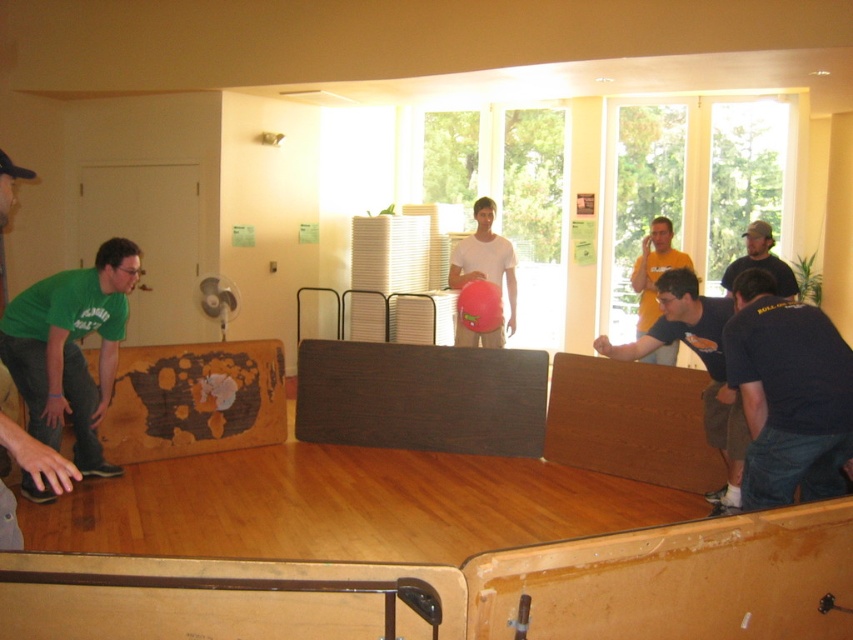
Can you confirm if green matte shirt at lower left is positioned below dark blue t-shirt at right?

Yes, green matte shirt at lower left is below dark blue t-shirt at right.

Is point (62, 324) closer to camera compared to point (782, 268)?

Yes, point (62, 324) is in front of point (782, 268).

Locate an element on the screen. green matte shirt at lower left is located at coordinates (70, 348).

Between wooden board at right and dark blue t-shirt at right, which one is positioned lower?

Positioned lower is wooden board at right.

Which is behind, point (599, 342) or point (724, 269)?

The point (724, 269) is more distant.

Find the location of `wooden board at right`. wooden board at right is located at coordinates (701, 362).

Does yellow t-shirt at upper center have a larger size compared to dark blue t-shirt at right?

Correct, yellow t-shirt at upper center is larger in size than dark blue t-shirt at right.

In the scene shown: Measure the distance between yellow t-shirt at upper center and dark blue t-shirt at right.

The distance of yellow t-shirt at upper center from dark blue t-shirt at right is 21.75 inches.

Identify the location of yellow t-shirt at upper center. This screenshot has width=853, height=640. (654, 269).

Where is `yellow t-shirt at upper center`? The image size is (853, 640). yellow t-shirt at upper center is located at coordinates (654, 269).